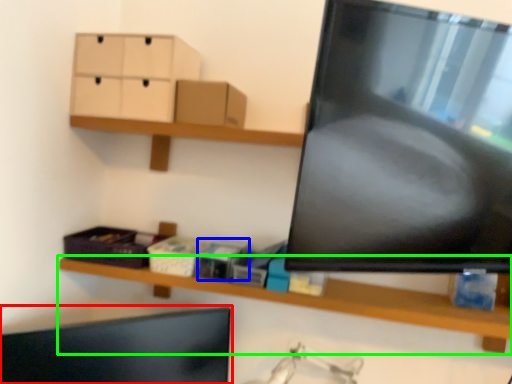
Question: Estimate the real-world distances between objects in this image. Which object is farther from computer monitor (highlighted by a red box), storage box (highlighted by a blue box) or shelf (highlighted by a green box)?

Choices:
 (A) storage box
 (B) shelf

Answer: (A)